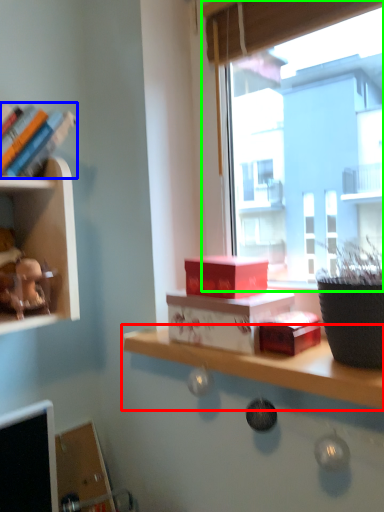
Question: Which object is the farthest from shelf (highlighted by a red box)? Choose among these: book (highlighted by a blue box) or window (highlighted by a green box).

Choices:
 (A) book
 (B) window

Answer: (B)